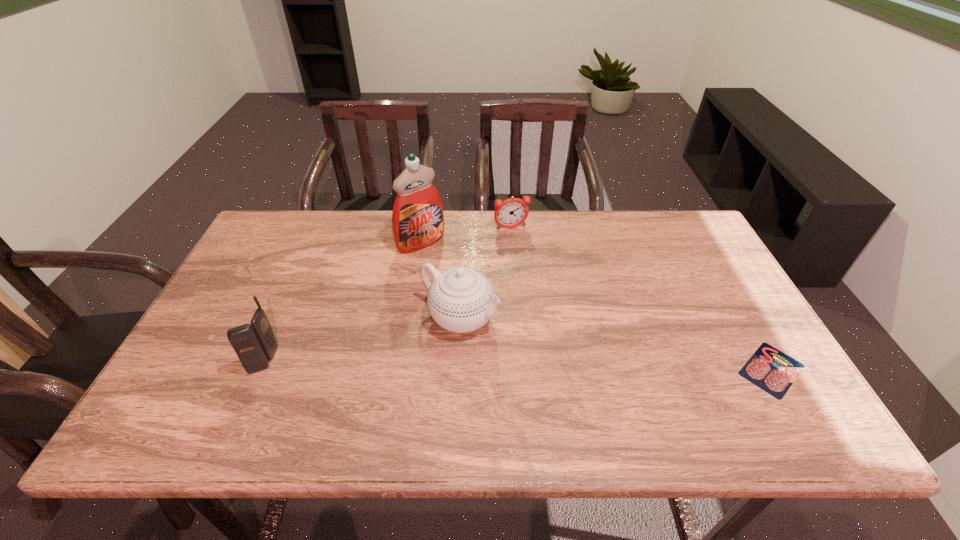
You are a GUI agent. You are given a task and a screenshot of the screen. Output one action in this format:
    pyautogui.click(x=<x>, y=<y>)
    Task: Click on the alarm clock that is positioned at the far edge
    The image size is (960, 540).
    Given the screenshot: What is the action you would take?
    pyautogui.click(x=512, y=212)

At what (x,y) coordinates should I click in order to perform the action: click on cellular telephone at the near edge. Please return your answer as a coordinate pair (x, y). Looking at the image, I should click on (255, 344).

Locate an element on the screen. The image size is (960, 540). salami that is at the near edge is located at coordinates (771, 370).

Find the location of a particular element. object that is at the right edge is located at coordinates (771, 370).

This screenshot has height=540, width=960. In order to click on object positioned at the near right corner in this screenshot , I will do `click(771, 370)`.

In the image, there is a desktop. Where is `vacant space at the far edge`? vacant space at the far edge is located at coordinates (603, 236).

Locate an element on the screen. free point at the near edge is located at coordinates (326, 401).

In the image, there is a desktop. Find the location of `vacant space at the left edge`. vacant space at the left edge is located at coordinates (226, 308).

The height and width of the screenshot is (540, 960). In order to click on vacant point at the right edge in this screenshot , I will do `click(679, 269)`.

In the image, there is a desktop. At what (x,y) coordinates should I click in order to perform the action: click on vacant space at the far left corner. Please return your answer as a coordinate pair (x, y). The image size is (960, 540). Looking at the image, I should click on (297, 249).